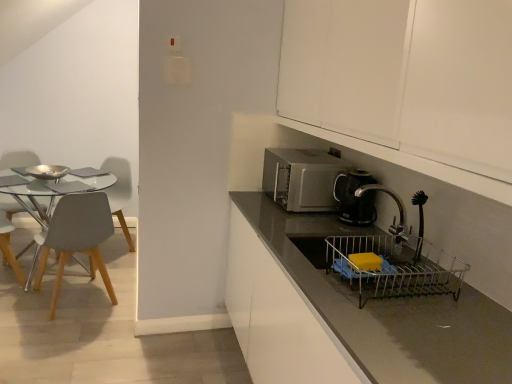
What do you see at coordinates (355, 198) in the screenshot? The width and height of the screenshot is (512, 384). I see `black plastic coffee maker at right` at bounding box center [355, 198].

What is the approximate width of black plastic coffee maker at right?

The width of black plastic coffee maker at right is 7.03 inches.

This screenshot has width=512, height=384. Describe the element at coordinates (119, 192) in the screenshot. I see `matte gray chair at left, arranged as the 2th chair when viewed from the right` at that location.

In order to face matte gray chair at left, the 3th chair in the left-to-right sequence, should I rotate leftwards or rightwards?

A 19.896 degree turn to the left will do.

Measure the distance between point (344, 129) and camera.

The depth of point (344, 129) is 5.33 feet.

This screenshot has width=512, height=384. Find the location of `satin silver microwave at center`. satin silver microwave at center is located at coordinates (302, 178).

What do you see at coordinates (18, 159) in the screenshot? The image size is (512, 384). I see `light gray wood chair at left, the 1th chair when ordered from left to right` at bounding box center [18, 159].

Find the location of a particular element. black plastic coffee maker at right is located at coordinates (355, 198).

Is black plastic coffee maker at right smaller than metallic silver sink at lower right?

Correct, black plastic coffee maker at right occupies less space than metallic silver sink at lower right.

Is black plastic coffee maker at right looking in the opposite direction of metallic silver sink at lower right?

No, black plastic coffee maker at right is not facing the opposite direction of metallic silver sink at lower right.

Who is shorter, black plastic coffee maker at right or metallic silver sink at lower right?

Standing shorter between the two is metallic silver sink at lower right.

Would you consider white matte cabinet at upper right to be distant from matte gray chair at left, the 3th chair in the left-to-right sequence?

white matte cabinet at upper right is positioned a significant distance from matte gray chair at left, the 3th chair in the left-to-right sequence.

Is white matte cabinet at upper right oriented away from matte gray chair at left, the 3th chair in the left-to-right sequence?

white matte cabinet at upper right is not turned away from matte gray chair at left, the 3th chair in the left-to-right sequence.

What are the coordinates of `the 2nd chair below when counting from the white matte cabinet at upper right (from the image's perspective)` in the screenshot? It's located at (119, 192).

Looking at this image, from the image's perspective, does light gray plastic chair at left, which is the third chair from right to left, appear lower than shiny silver bowl at left?

Yes, from the image's perspective, light gray plastic chair at left, which is the third chair from right to left, is beneath shiny silver bowl at left.

Does point (32, 265) appear closer or farther from the camera than point (50, 173)?

Point (32, 265).

From a real-world perspective, is light gray plastic chair at left, which is counted as the 2th chair, starting from the left, physically above shiny silver bowl at left?

Actually, light gray plastic chair at left, which is counted as the 2th chair, starting from the left, is physically below shiny silver bowl at left in the real world.

Is light gray plastic chair at left, which is counted as the 2th chair, starting from the left, far from shiny silver bowl at left?

No, light gray plastic chair at left, which is counted as the 2th chair, starting from the left, is not far from shiny silver bowl at left.

Which object is closer to the camera taking this photo, metallic silver sink at lower right or light gray wood chair at left, the 1th chair when ordered from left to right?

Positioned in front is metallic silver sink at lower right.

How many degrees apart are the facing directions of metallic silver sink at lower right and light gray wood chair at left, the 1th chair when ordered from left to right?

There is a 108-degree angle between the facing directions of metallic silver sink at lower right and light gray wood chair at left, the 1th chair when ordered from left to right.

From a real-world perspective, which is physically below, metallic silver sink at lower right or light gray wood chair at left, acting as the fourth chair starting from the right?

light gray wood chair at left, acting as the fourth chair starting from the right, is physically lower.

From the picture: Which object is further away from the camera taking this photo, black plastic coffee maker at right or satin silver microwave at center?

satin silver microwave at center is further away from the camera.

Which object is thinner, black plastic coffee maker at right or satin silver microwave at center?

black plastic coffee maker at right.

How different are the orientations of black plastic coffee maker at right and satin silver microwave at center in degrees?

There is a 2.37-degree angle between the facing directions of black plastic coffee maker at right and satin silver microwave at center.

Which of these two, metallic silver sink at lower right or light gray plastic chair at left, which is counted as the 2th chair, starting from the left, is smaller?

With smaller size is metallic silver sink at lower right.

From the picture: Is metallic silver sink at lower right not within light gray plastic chair at left, which is counted as the 2th chair, starting from the left?

Indeed, metallic silver sink at lower right is completely outside light gray plastic chair at left, which is counted as the 2th chair, starting from the left.

Considering the points (393, 255) and (81, 263), which point is in front, point (393, 255) or point (81, 263)?

The point (393, 255) is more forward.

From the image's perspective, is metallic silver sink at lower right located above or below light gray plastic chair at left, which is counted as the 2th chair, starting from the left?

metallic silver sink at lower right is situated lower than light gray plastic chair at left, which is counted as the 2th chair, starting from the left, in the image.

From a real-world perspective, which object rests below the other?

light gray plastic chair at left, the 4th chair from the left, is physically lower.

Which is correct: white matte cabinet at upper right is inside light gray plastic chair at left, the first chair positioned from the right, or outside of it?

white matte cabinet at upper right cannot be found inside light gray plastic chair at left, the first chair positioned from the right.

Is white matte cabinet at upper right further to the viewer compared to light gray plastic chair at left, the first chair positioned from the right?

No.

Does point (489, 14) appear closer or farther from the camera than point (36, 274)?

Point (489, 14) is positioned closer to the camera compared to point (36, 274).

Where is `kitchen appliance above the metallic silver sink at lower right (from the image's perspective)`? Image resolution: width=512 pixels, height=384 pixels. kitchen appliance above the metallic silver sink at lower right (from the image's perspective) is located at coordinates (355, 198).

There is a white matte cabinet at upper right. Where is `the 2nd chair below it (from the image's perspective)`? The image size is (512, 384). the 2nd chair below it (from the image's perspective) is located at coordinates (119, 192).

From the image, which object appears to be nearer to light gray wood chair at left, the 1th chair when ordered from left to right, metallic silver sink at lower right or light gray plastic chair at left, which is counted as the 2th chair, starting from the left?

light gray plastic chair at left, which is counted as the 2th chair, starting from the left, lies closer to light gray wood chair at left, the 1th chair when ordered from left to right, than the other object.

Based on their spatial positions, is matte gray countertop at center or light gray plastic chair at left, which is the third chair from right to left, closer to black plastic coffee maker at right?

The object closer to black plastic coffee maker at right is matte gray countertop at center.

Based on their spatial positions, is shiny silver bowl at left or light gray plastic chair at left, the first chair positioned from the right, further from white matte cabinet at upper right?

shiny silver bowl at left is positioned further to the anchor white matte cabinet at upper right.

From the image, which object appears to be nearer to metallic silver sink at lower right, light gray plastic chair at left, the first chair positioned from the right, or light gray wood chair at left, the 1th chair when ordered from left to right?

Among the two, light gray plastic chair at left, the first chair positioned from the right, is located nearer to metallic silver sink at lower right.

Based on their spatial positions, is shiny silver bowl at left or metallic silver sink at lower right further from light gray plastic chair at left, which is the third chair from right to left?

metallic silver sink at lower right lies further to light gray plastic chair at left, which is the third chair from right to left, than the other object.

Looking at the image, which one is located further to light gray plastic chair at left, the first chair positioned from the right, light gray wood chair at left, acting as the fourth chair starting from the right, or light gray plastic chair at left, which is counted as the 2th chair, starting from the left?

light gray wood chair at left, acting as the fourth chair starting from the right, is positioned further to the anchor light gray plastic chair at left, the first chair positioned from the right.

Which object lies nearer to the anchor point light gray wood chair at left, acting as the fourth chair starting from the right, white matte cabinet at upper right or light gray plastic chair at left, which is the third chair from right to left?

light gray plastic chair at left, which is the third chair from right to left, lies closer to light gray wood chair at left, acting as the fourth chair starting from the right, than the other object.

From the image, which object appears to be nearer to satin silver microwave at center, light gray plastic chair at left, the 4th chair from the left, or matte gray countertop at center?

matte gray countertop at center is closer to satin silver microwave at center.

Image resolution: width=512 pixels, height=384 pixels. I want to click on microwave oven situated between light gray plastic chair at left, the first chair positioned from the right, and white matte cabinet at upper right from left to right, so click(x=302, y=178).

At what (x,y) coordinates should I click in order to perform the action: click on kitchen appliance positioned between white matte cabinet at upper right and matte gray chair at left, the 3th chair in the left-to-right sequence, from near to far. Please return your answer as a coordinate pair (x, y). The width and height of the screenshot is (512, 384). Looking at the image, I should click on (355, 198).

Identify the location of appliance located between light gray plastic chair at left, which is the third chair from right to left, and matte gray chair at left, the 3th chair in the left-to-right sequence, in the depth direction. (48, 172).

You are a GUI agent. You are given a task and a screenshot of the screen. Output one action in this format:
    pyautogui.click(x=<x>, y=<y>)
    Task: Click on the sink between white matte cabinet at upper right and matte gray countertop at center in the vertical direction
    The image size is (512, 384).
    Given the screenshot: What is the action you would take?
    pyautogui.click(x=395, y=259)